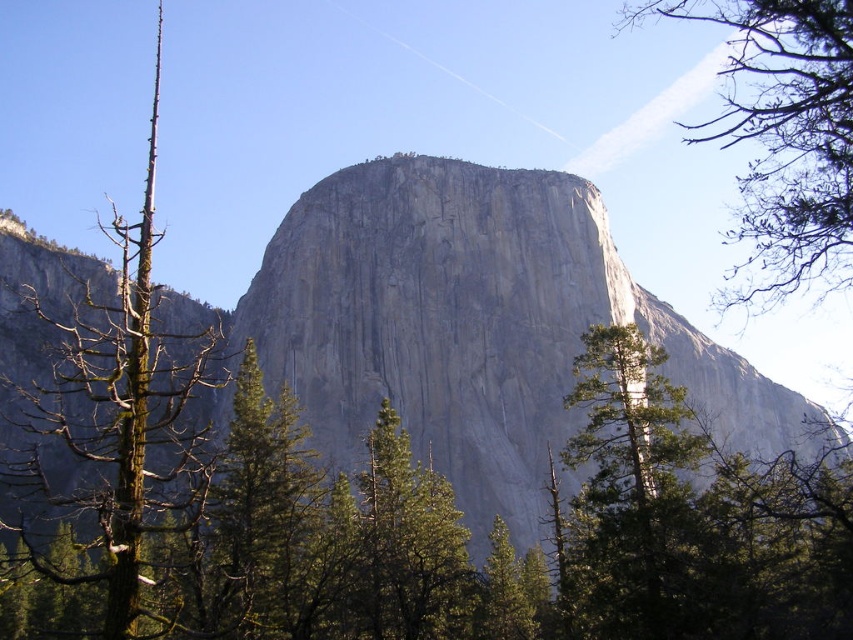
Between gray/rough rock at center and green textured tree at center, which one appears on the right side from the viewer's perspective?

green textured tree at center

Who is more forward, (399, 403) or (664, 461)?

Point (664, 461) is more forward.

You are a GUI agent. You are given a task and a screenshot of the screen. Output one action in this format:
    pyautogui.click(x=<x>, y=<y>)
    Task: Click on the gray/rough rock at center
    The image size is (853, 640).
    Given the screenshot: What is the action you would take?
    pyautogui.click(x=473, y=324)

Looking at this image, between gray/rough rock at center and green leafy tree at upper right, which one is positioned lower?

gray/rough rock at center is lower down.

What do you see at coordinates (473, 324) in the screenshot? The height and width of the screenshot is (640, 853). I see `gray/rough rock at center` at bounding box center [473, 324].

I want to click on gray/rough rock at center, so click(473, 324).

Is green leafy tree at upper right shorter than green textured tree at center?

Incorrect, green leafy tree at upper right's height does not fall short of green textured tree at center's.

Is green leafy tree at upper right positioned before green textured tree at center?

Yes.

Does point (775, 3) come in front of point (610, 416)?

Yes, point (775, 3) is in front of point (610, 416).

At what (x,y) coordinates should I click in order to perform the action: click on green leafy tree at upper right. Please return your answer as a coordinate pair (x, y). Looking at the image, I should click on (781, 138).